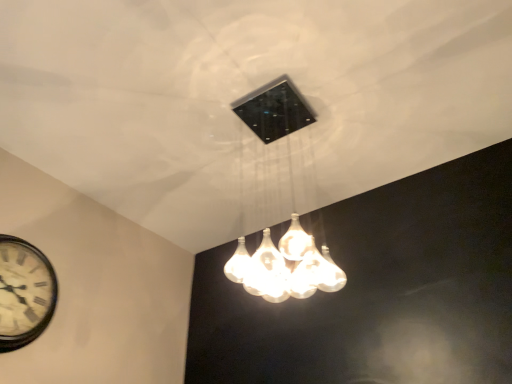
Question: Is translucent glass chandelier at center in front of or behind white wooden clock at lower left in the image?

Choices:
 (A) behind
 (B) front

Answer: (B)

Question: Based on their sizes in the image, would you say translucent glass chandelier at center is bigger or smaller than white wooden clock at lower left?

Choices:
 (A) big
 (B) small

Answer: (A)

Question: Is translucent glass chandelier at center taller or shorter than white wooden clock at lower left?

Choices:
 (A) short
 (B) tall

Answer: (B)

Question: Does point [x=48, y=289] appear closer or farther from the camera than point [x=288, y=119]?

Choices:
 (A) closer
 (B) farther

Answer: (B)

Question: In the image, is white wooden clock at lower left positioned in front of or behind translucent glass chandelier at center?

Choices:
 (A) front
 (B) behind

Answer: (B)

Question: In the image, is white wooden clock at lower left on the left side or the right side of translucent glass chandelier at center?

Choices:
 (A) right
 (B) left

Answer: (B)

Question: From their relative heights in the image, would you say white wooden clock at lower left is taller or shorter than translucent glass chandelier at center?

Choices:
 (A) short
 (B) tall

Answer: (A)